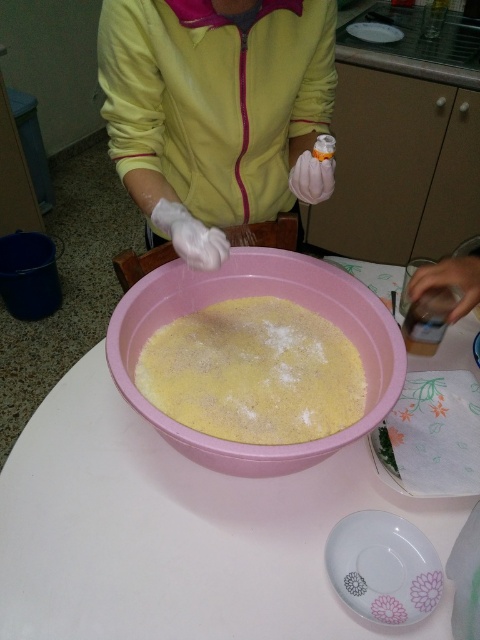
Question: Is porcelain plate at lower center smaller than white glossy plate at upper center?

Choices:
 (A) yes
 (B) no

Answer: (A)

Question: Which point is closer to the camera?

Choices:
 (A) (350, 28)
 (B) (147, 285)
 (C) (123, 444)

Answer: (B)

Question: Is pink plastic bowl at center above porcelain plate at lower center?

Choices:
 (A) no
 (B) yes

Answer: (B)

Question: Which of the following is the farthest from the observer?

Choices:
 (A) white plastic table at center
 (B) porcelain plate at lower center
 (C) white glossy plate at upper center

Answer: (C)

Question: Which point appears farthest from the camera in this image?

Choices:
 (A) (336, 276)
 (B) (360, 593)
 (C) (112, 433)

Answer: (A)

Question: Can you confirm if white plastic table at center is positioned above white glossy plate at upper center?

Choices:
 (A) yes
 (B) no

Answer: (B)